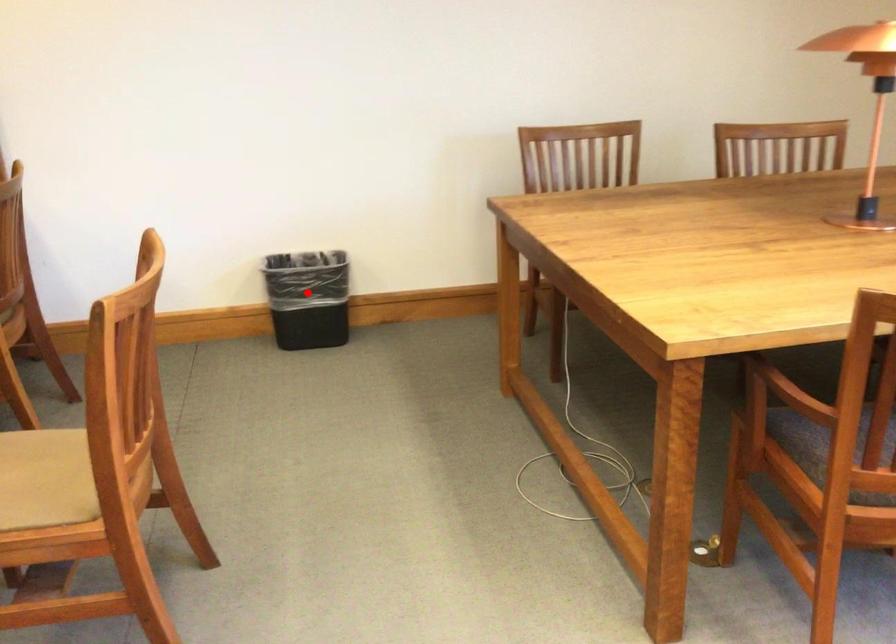
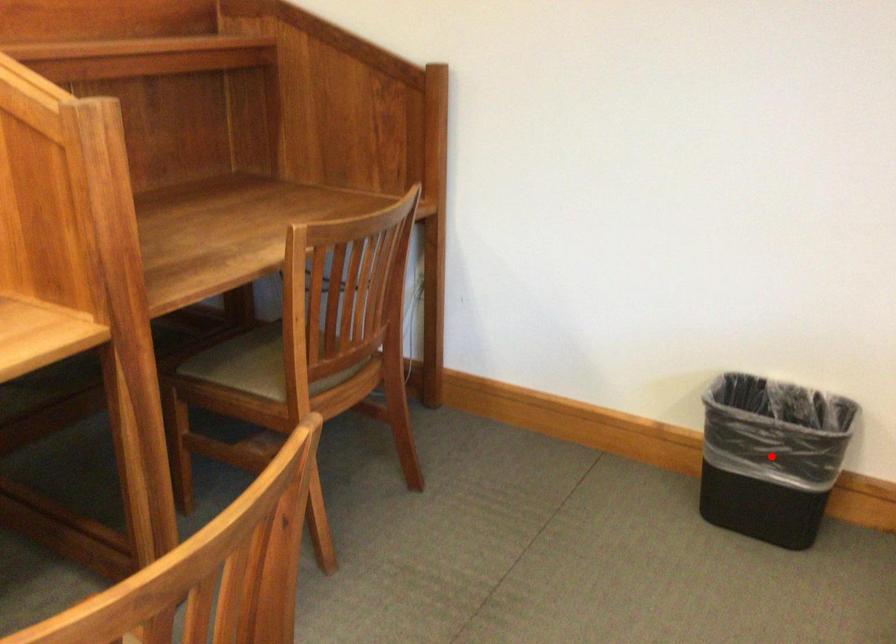
I am providing you with two images of the same scene from different viewpoints. A red point is marked on the first image and another point is marked on the second image. Are the points marked in image1 and image2 representing the same 3D position?

Yes